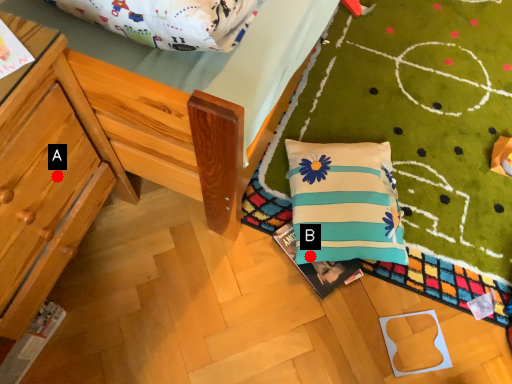
Question: Two points are circled on the image, labeled by A and B beside each circle. Which point is closer to the camera?

Choices:
 (A) A is closer
 (B) B is closer

Answer: (A)